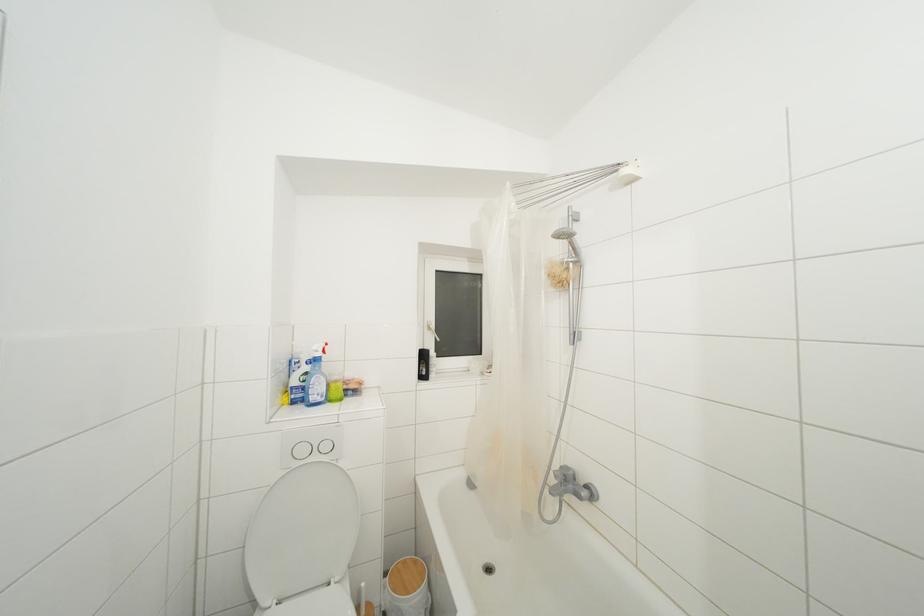
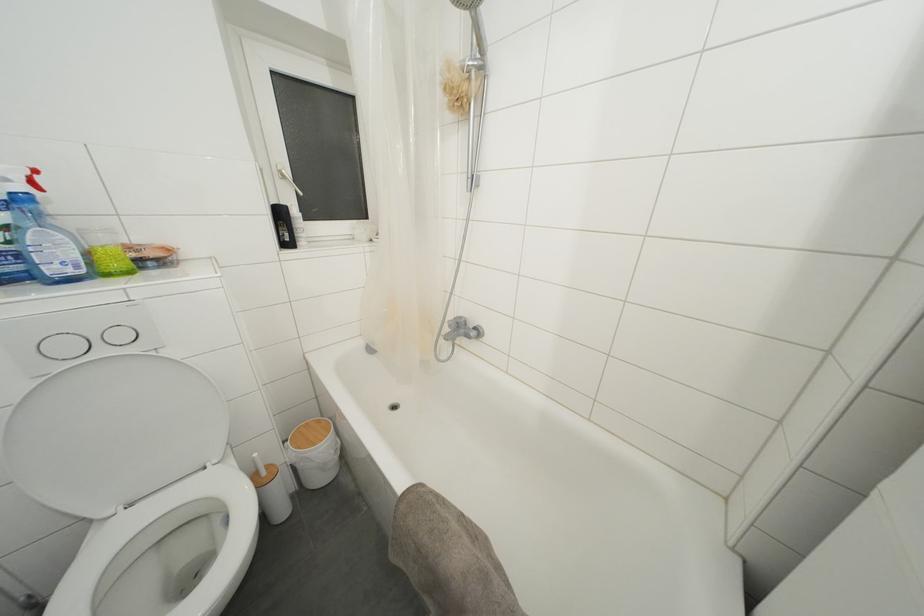
Find the pixel in the second image that matches (x=561, y=469) in the first image.

(455, 321)